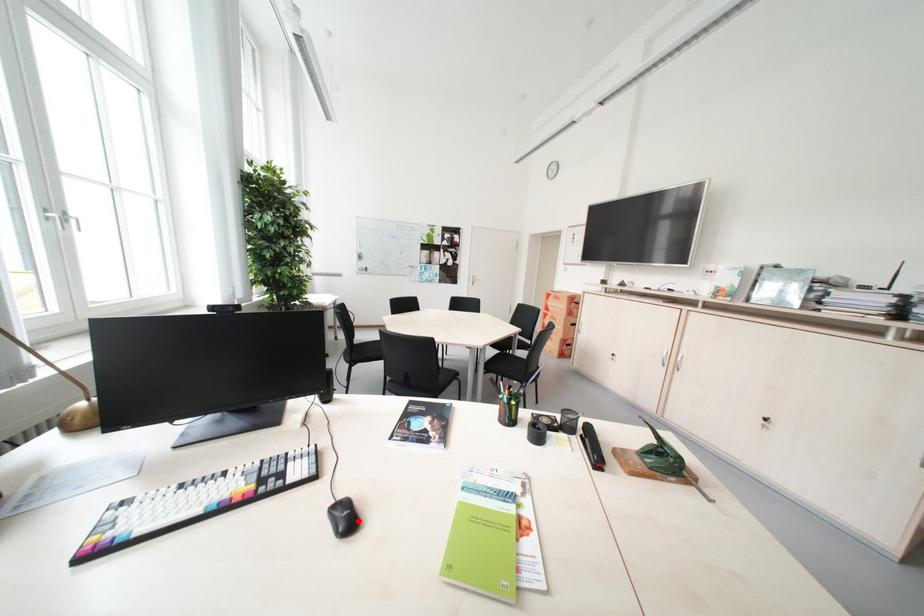
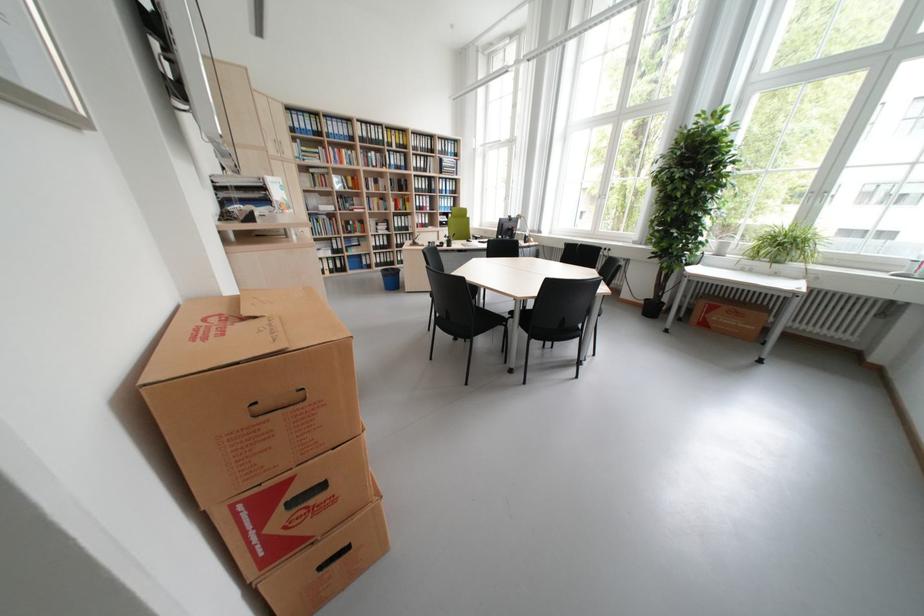
Question: I am providing you with two images of the same scene from different viewpoints. A red point is marked on the first image. At the location where the point appears in image 1, is it still visible in image 2?

Choices:
 (A) Yes
 (B) No

Answer: (B)